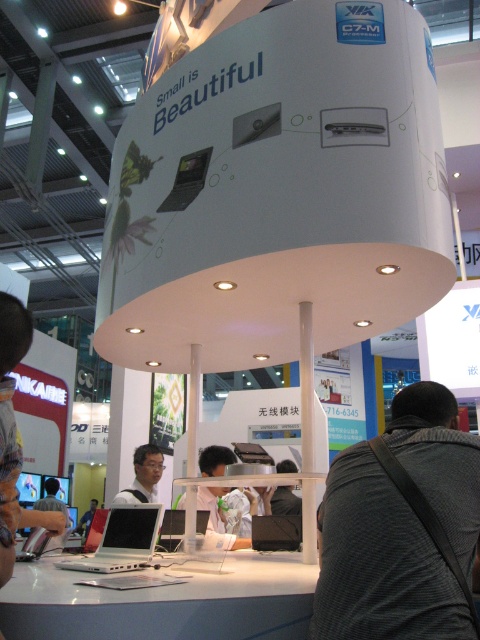
Question: Which of these objects is positioned farthest from the dark gray fabric shirt at center?

Choices:
 (A) matte black laptop at lower left
 (B) black textured jacket at lower right

Answer: (B)

Question: Which object is the farthest from the satin silver laptop at center?

Choices:
 (A) dark gray shirt at lower left
 (B) black matte laptop at center

Answer: (A)

Question: Does white glossy table at center come in front of silver metallic laptop at center?

Choices:
 (A) yes
 (B) no

Answer: (A)

Question: Can you confirm if matte black laptop at lower left is positioned to the right of black matte laptop at center?

Choices:
 (A) yes
 (B) no

Answer: (B)

Question: From the image, what is the correct spatial relationship of matte black laptop at lower left in relation to dark gray fabric shirt at center?

Choices:
 (A) left
 (B) right

Answer: (A)

Question: Which of the following is the closest to the observer?

Choices:
 (A) (212, 509)
 (B) (19, 433)

Answer: (B)